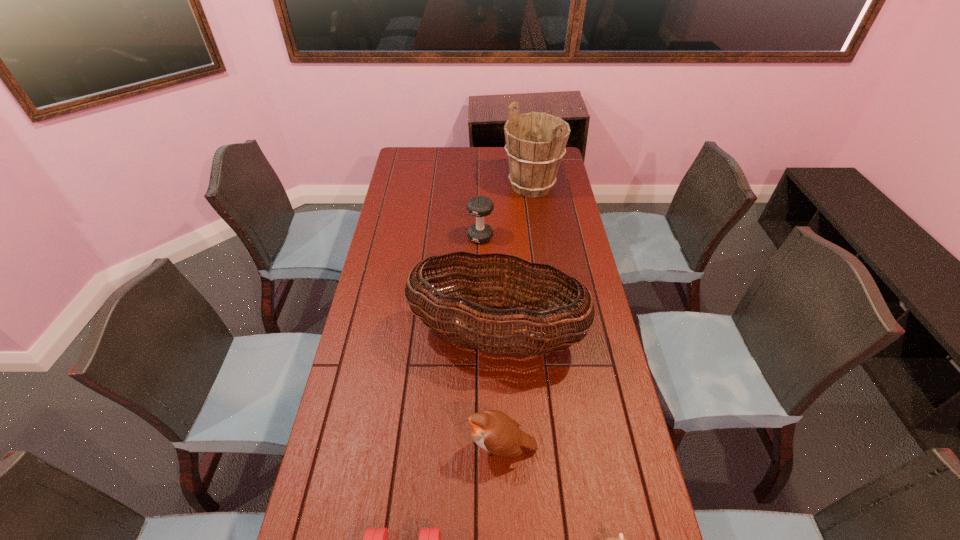
Where is `the farthest object`? the farthest object is located at coordinates (535, 142).

Identify the location of the tallest object. pos(535,142).

Locate an element on the screen. The width and height of the screenshot is (960, 540). the fourth nearest object is located at coordinates (506, 335).

This screenshot has width=960, height=540. In order to click on the second tallest object in this screenshot , I will do `click(506, 335)`.

The width and height of the screenshot is (960, 540). I want to click on the taller dumbbell, so click(479, 206).

Locate an element on the screen. The width and height of the screenshot is (960, 540). the farther dumbbell is located at coordinates (479, 206).

The width and height of the screenshot is (960, 540). I want to click on the third nearest object, so click(x=494, y=431).

I want to click on vacant space located on the front of the tallest object, so click(542, 264).

The height and width of the screenshot is (540, 960). What are the coordinates of `blank area located on the front of the fifth shortest object` in the screenshot? It's located at (499, 428).

Find the location of a particular element. free space located 0.170m on the right of the farther dumbbell is located at coordinates (536, 237).